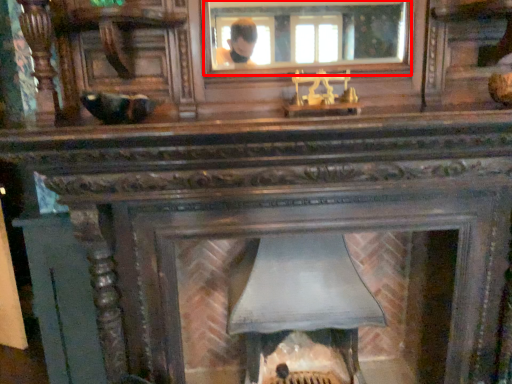
Question: From the image's perspective, what is the correct spatial positioning of mirror (annotated by the red box) in reference to fireplace?

Choices:
 (A) above
 (B) below

Answer: (A)